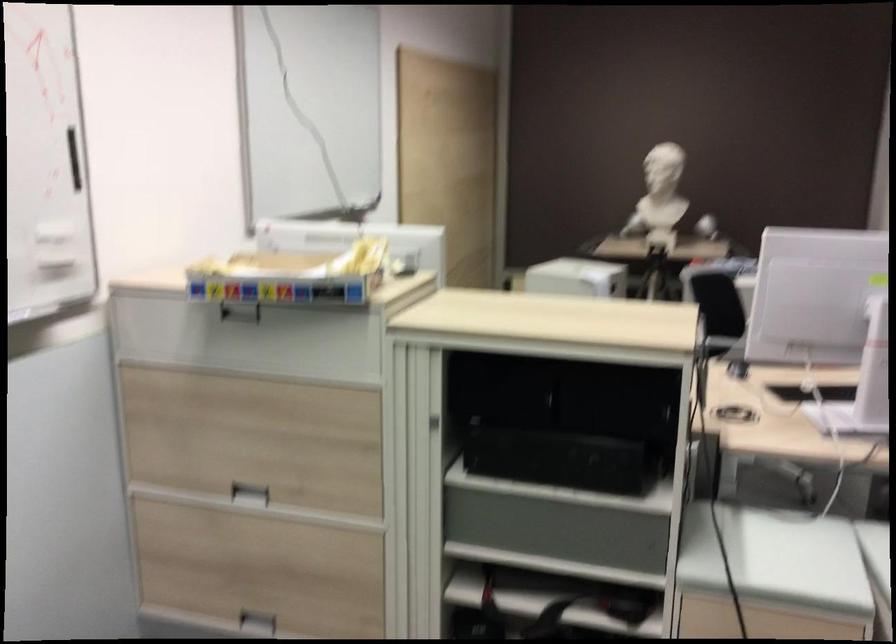
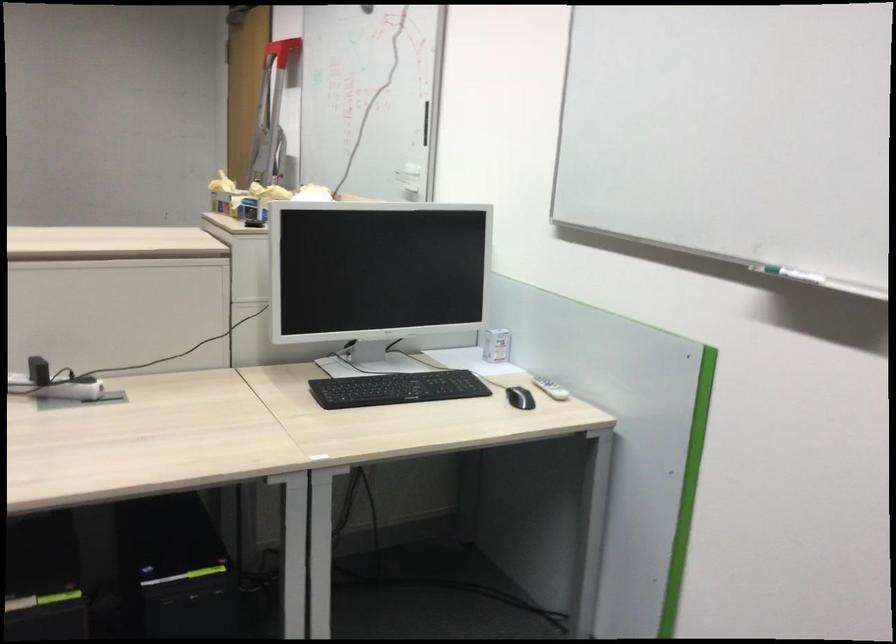
The point at (343, 205) is marked in the first image. Where is the corresponding point in the second image?

(794, 275)